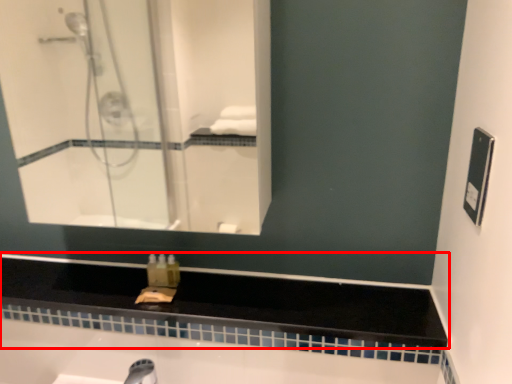
Question: From the image's perspective, what is the correct spatial positioning of counter top (annotated by the red box) in reference to mirror?

Choices:
 (A) below
 (B) above

Answer: (A)